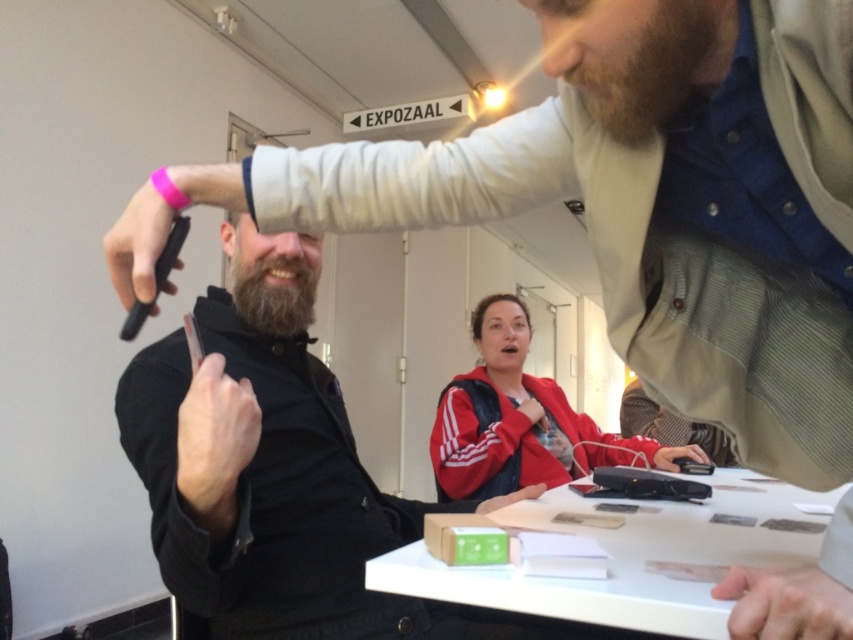
Between dark brown textured beard at upper right and dark brown thick beard at center, which one appears on the left side from the viewer's perspective?

dark brown thick beard at center

Is point (659, 8) farther from camera compared to point (236, 294)?

That is False.

At what (x,y) coordinates should I click in order to perform the action: click on dark brown textured beard at upper right. Please return your answer as a coordinate pair (x, y). This screenshot has height=640, width=853. Looking at the image, I should click on (653, 70).

Locate an element on the screen. Image resolution: width=853 pixels, height=640 pixels. dark brown textured beard at upper right is located at coordinates (653, 70).

Can you confirm if black matte jacket at center is positioned to the right of red adidas jacket at center?

In fact, black matte jacket at center is to the left of red adidas jacket at center.

Find the location of a particular element. black matte jacket at center is located at coordinates [260, 486].

How far apart are smooth skin hand at lower right and matte black hand at lower center?

smooth skin hand at lower right is 28.93 inches from matte black hand at lower center.

From the picture: Is smooth skin hand at lower right shorter than matte black hand at lower center?

Yes, smooth skin hand at lower right is shorter than matte black hand at lower center.

Locate an element on the screen. This screenshot has width=853, height=640. smooth skin hand at lower right is located at coordinates (785, 604).